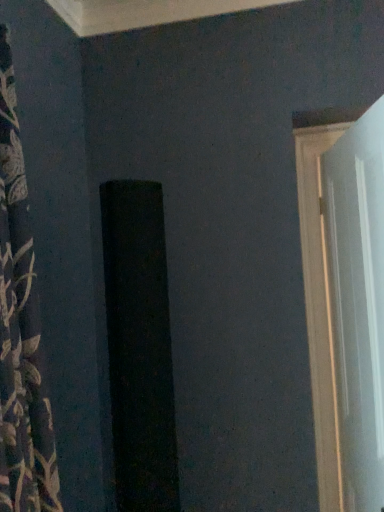
Where is `white glossy door at right`? Image resolution: width=384 pixels, height=512 pixels. white glossy door at right is located at coordinates (345, 304).

In order to face white glossy door at right, should I rotate leftwards or rightwards?

Turn right approximately 22.128 degrees to face it.

Describe the element at coordinates (345, 304) in the screenshot. Image resolution: width=384 pixels, height=512 pixels. I see `white glossy door at right` at that location.

Locate an element on the screen. The height and width of the screenshot is (512, 384). floral fabric curtain at left is located at coordinates (20, 330).

Describe the element at coordinates (20, 330) in the screenshot. The width and height of the screenshot is (384, 512). I see `floral fabric curtain at left` at that location.

This screenshot has height=512, width=384. What are the coordinates of `white glossy door at right` in the screenshot? It's located at (345, 304).

Is white glossy door at right to the right of floral fabric curtain at left from the viewer's perspective?

Yes, white glossy door at right is to the right of floral fabric curtain at left.

Looking at this image, is the position of white glossy door at right more distant than that of floral fabric curtain at left?

Yes, it is behind floral fabric curtain at left.

Is point (335, 347) less distant than point (29, 351)?

No, (335, 347) is further to viewer.

Looking at this image, from the image's perspective, between white glossy door at right and floral fabric curtain at left, who is located below?

From the image's view, white glossy door at right is below.

From a real-world perspective, who is located lower, white glossy door at right or floral fabric curtain at left?

From a 3D spatial view, white glossy door at right is below.

Is white glossy door at right thinner than floral fabric curtain at left?

Indeed, white glossy door at right has a lesser width compared to floral fabric curtain at left.

In terms of height, does white glossy door at right look taller or shorter compared to floral fabric curtain at left?

Clearly, white glossy door at right is taller compared to floral fabric curtain at left.

Who is bigger, white glossy door at right or floral fabric curtain at left?

Bigger between the two is floral fabric curtain at left.

Based on the photo, can we say white glossy door at right lies outside floral fabric curtain at left?

Yes, white glossy door at right is located beyond the bounds of floral fabric curtain at left.

Is white glossy door at right next to floral fabric curtain at left and touching it?

No, white glossy door at right is not next to floral fabric curtain at left.

Is white glossy door at right facing away from floral fabric curtain at left?

That's right, white glossy door at right is facing away from floral fabric curtain at left.

Can you tell me how much white glossy door at right and floral fabric curtain at left differ in facing direction?

The facing directions of white glossy door at right and floral fabric curtain at left are 11.3 degrees apart.

Locate an element on the screen. This screenshot has height=512, width=384. door behind the floral fabric curtain at left is located at coordinates (345, 304).

Visually, is floral fabric curtain at left positioned to the left or to the right of white glossy door at right?

Clearly, floral fabric curtain at left is on the left of white glossy door at right in the image.

Is floral fabric curtain at left further to the viewer compared to white glossy door at right?

No, it is in front of white glossy door at right.

Is point (19, 410) positioned behind point (331, 436)?

No, it is in front of (331, 436).

From the image's perspective, would you say floral fabric curtain at left is positioned over white glossy door at right?

Yes, from the image's perspective, floral fabric curtain at left is over white glossy door at right.

From a real-world perspective, does floral fabric curtain at left sit lower than white glossy door at right?

No, from a real-world perspective, floral fabric curtain at left is not under white glossy door at right.

Considering the sizes of objects floral fabric curtain at left and white glossy door at right in the image provided, who is thinner, floral fabric curtain at left or white glossy door at right?

With smaller width is white glossy door at right.

Considering the sizes of floral fabric curtain at left and white glossy door at right in the image, is floral fabric curtain at left taller or shorter than white glossy door at right?

floral fabric curtain at left is shorter than white glossy door at right.

Considering the relative sizes of floral fabric curtain at left and white glossy door at right in the image provided, is floral fabric curtain at left bigger than white glossy door at right?

Yes, floral fabric curtain at left is bigger than white glossy door at right.

Is white glossy door at right located within floral fabric curtain at left?

Definitely not — white glossy door at right is not inside floral fabric curtain at left.

Can you see floral fabric curtain at left touching white glossy door at right?

They are not placed beside each other.

Is floral fabric curtain at left facing towards white glossy door at right?

No, floral fabric curtain at left is not facing towards white glossy door at right.

How different are the orientations of floral fabric curtain at left and white glossy door at right in degrees?

The angle between the facing direction of floral fabric curtain at left and the facing direction of white glossy door at right is 11.3 degrees.

How far apart are floral fabric curtain at left and white glossy door at right?

3.66 feet.

Image resolution: width=384 pixels, height=512 pixels. What are the coordinates of `curtain above the white glossy door at right (from a real-world perspective)` in the screenshot? It's located at (20, 330).

This screenshot has height=512, width=384. I want to click on door below the floral fabric curtain at left (from the image's perspective), so click(x=345, y=304).

Identify the location of curtain located in front of the white glossy door at right. The image size is (384, 512). (20, 330).